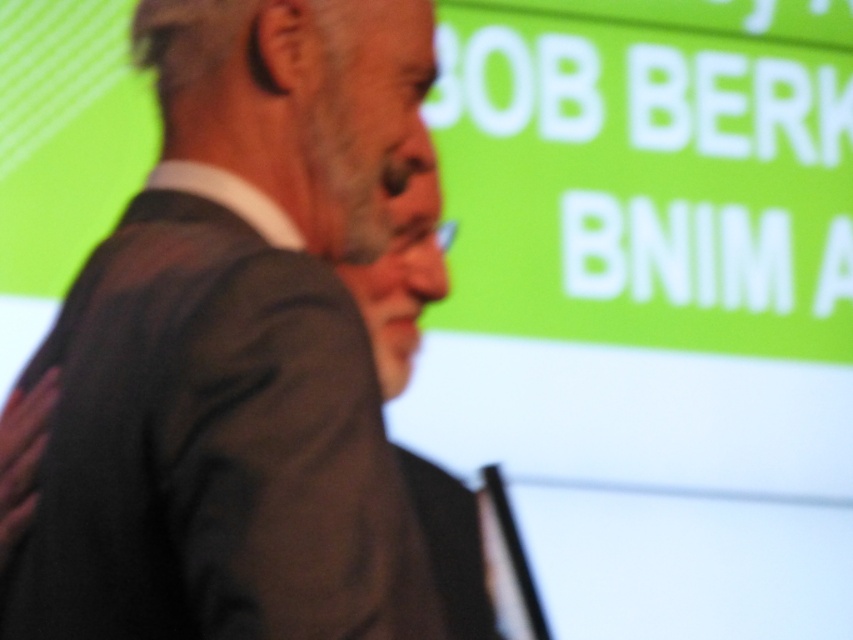
Question: Can you confirm if dark gray suit at center is positioned above matte black suit at center?

Choices:
 (A) no
 (B) yes

Answer: (B)

Question: Is dark gray suit at center above matte black suit at center?

Choices:
 (A) no
 (B) yes

Answer: (B)

Question: Which point is farther from the camera taking this photo?

Choices:
 (A) (378, 499)
 (B) (396, 323)

Answer: (B)

Question: Which of the following is the farthest from the observer?

Choices:
 (A) dark gray suit at center
 (B) matte black suit at center

Answer: (B)

Question: Can you confirm if dark gray suit at center is smaller than matte black suit at center?

Choices:
 (A) no
 (B) yes

Answer: (A)

Question: Which of the following is the closest to the observer?

Choices:
 (A) dark gray suit at center
 (B) matte black suit at center

Answer: (A)